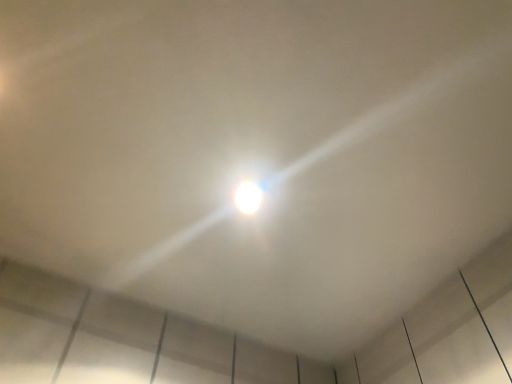
Question: Should I look upward or downward to see white glossy light bulb at center?

Choices:
 (A) down
 (B) up

Answer: (A)